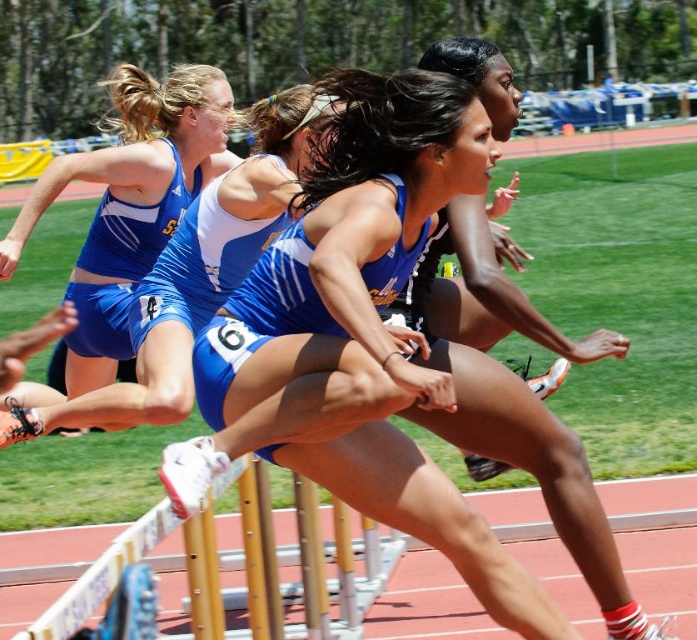
Question: Observing the image, what is the correct spatial positioning of wooden hurdle at center in reference to matte blue shorts at left?

Choices:
 (A) left
 (B) right

Answer: (B)

Question: Does blue fabric shorts at center have a lesser width compared to matte blue shorts at left?

Choices:
 (A) no
 (B) yes

Answer: (A)

Question: Considering the real-world distances, which object is farthest from the blue fabric shorts at center?

Choices:
 (A) wooden hurdle at center
 (B) matte blue shorts at left

Answer: (B)

Question: Is blue fabric shorts at center below wooden hurdle at center?

Choices:
 (A) yes
 (B) no

Answer: (B)

Question: Which object is farther from the camera taking this photo?

Choices:
 (A) matte blue shorts at left
 (B) wooden hurdle at center
 (C) blue fabric shorts at center

Answer: (A)

Question: Which point is farther from the camera taking this photo?

Choices:
 (A) (382, 200)
 (B) (298, 536)

Answer: (B)